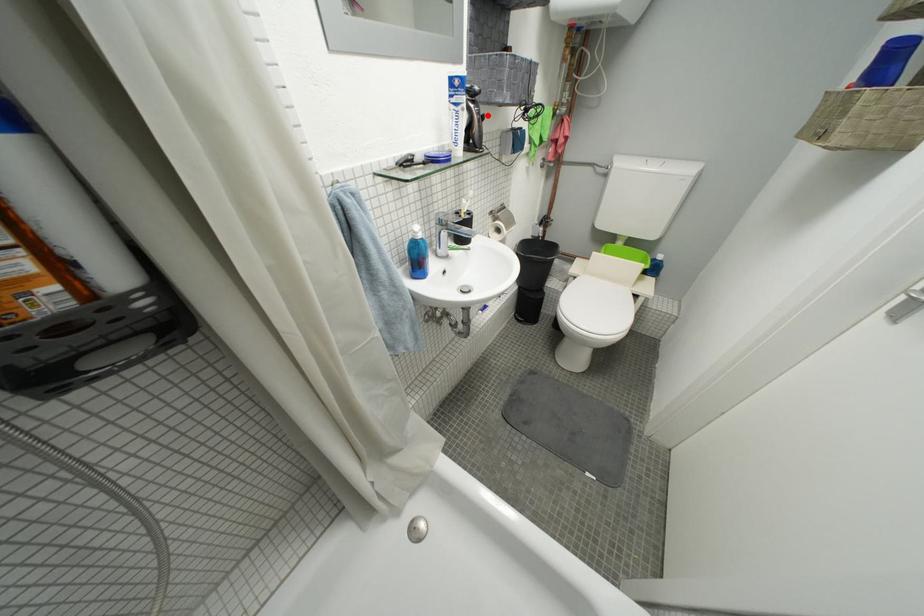
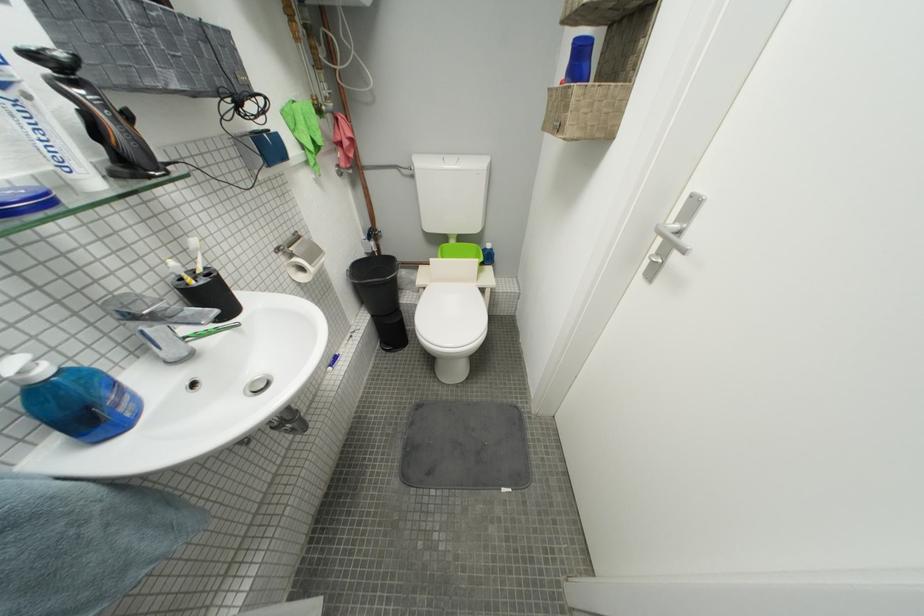
In the second image, find the point that corresponds to the highlighted location in the first image.

(114, 108)